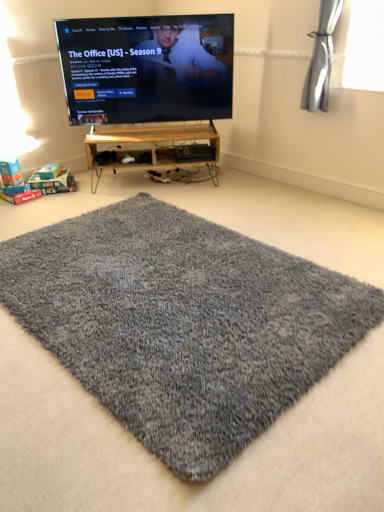
Question: Is wooden shelf at center placed right next to gray shaggy rug at center?

Choices:
 (A) no
 (B) yes

Answer: (A)

Question: Is wooden shelf at center not near gray shaggy rug at center?

Choices:
 (A) yes
 (B) no

Answer: (A)

Question: Does wooden shelf at center turn towards gray shaggy rug at center?

Choices:
 (A) yes
 (B) no

Answer: (A)

Question: From a real-world perspective, is wooden shelf at center physically above gray shaggy rug at center?

Choices:
 (A) yes
 (B) no

Answer: (A)

Question: From the image's perspective, is wooden shelf at center under gray shaggy rug at center?

Choices:
 (A) yes
 (B) no

Answer: (B)

Question: From the image's perspective, is gray shaggy rug at center above or below matte black tv at upper center?

Choices:
 (A) below
 (B) above

Answer: (A)

Question: Is gray shaggy rug at center situated inside matte black tv at upper center or outside?

Choices:
 (A) outside
 (B) inside

Answer: (A)

Question: From a real-world perspective, is gray shaggy rug at center above or below matte black tv at upper center?

Choices:
 (A) above
 (B) below

Answer: (B)

Question: In terms of height, does gray shaggy rug at center look taller or shorter compared to matte black tv at upper center?

Choices:
 (A) short
 (B) tall

Answer: (A)

Question: From the image's perspective, is wooden shelf at center positioned above or below matte black tv at upper center?

Choices:
 (A) above
 (B) below

Answer: (B)

Question: In terms of width, does wooden shelf at center look wider or thinner when compared to matte black tv at upper center?

Choices:
 (A) wide
 (B) thin

Answer: (A)

Question: Relative to matte black tv at upper center, is wooden shelf at center in front or behind?

Choices:
 (A) front
 (B) behind

Answer: (B)

Question: Is wooden shelf at center situated inside matte black tv at upper center or outside?

Choices:
 (A) inside
 (B) outside

Answer: (B)

Question: Would you say gray shaggy rug at center is to the left or to the right of wooden shelf at center in the picture?

Choices:
 (A) left
 (B) right

Answer: (B)

Question: Considering their positions, is gray shaggy rug at center located in front of or behind wooden shelf at center?

Choices:
 (A) behind
 (B) front

Answer: (B)